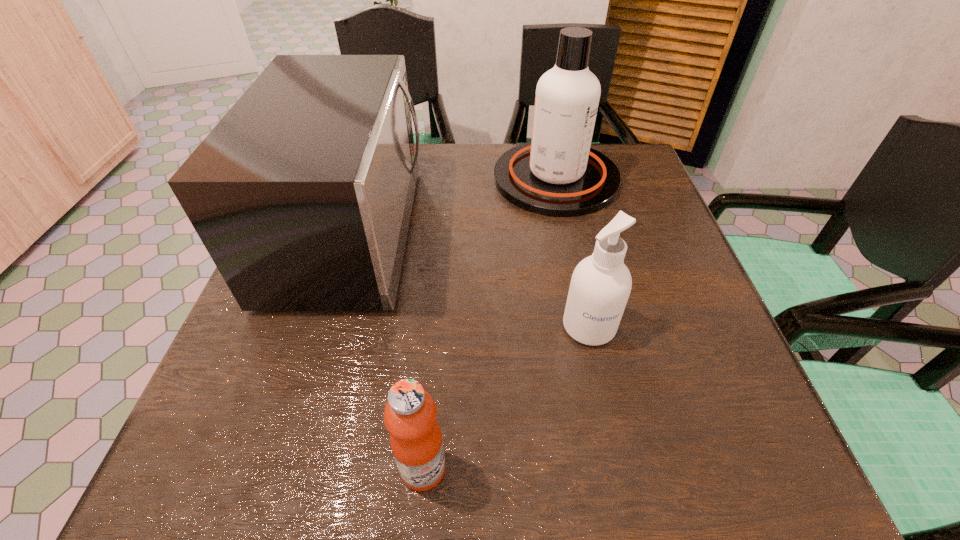
This screenshot has width=960, height=540. What are the coordinates of `vacant space at the left edge` in the screenshot? It's located at (303, 315).

Identify the location of vacant space at the right edge. This screenshot has width=960, height=540. (690, 319).

In the image, there is a desktop. Where is `blank space at the near left corner`? This screenshot has height=540, width=960. blank space at the near left corner is located at coordinates (230, 490).

Locate an element on the screen. The height and width of the screenshot is (540, 960). unoccupied area between the taller cleansing agent and the leftmost object is located at coordinates (454, 205).

The image size is (960, 540). What are the coordinates of `free point between the third tallest object and the tallest object` in the screenshot? It's located at (572, 253).

In order to click on free space between the fruit juice and the tallest object in this screenshot , I will do `click(490, 323)`.

In order to click on unoccupied area between the nearest object and the microwave oven in this screenshot , I will do `click(388, 350)`.

Where is `unoccupied area between the leftmost object and the tallest object`? unoccupied area between the leftmost object and the tallest object is located at coordinates (454, 205).

Find the location of a particular element. The height and width of the screenshot is (540, 960). vacant area between the microwave oven and the nearer cleansing agent is located at coordinates (470, 279).

Where is `vacant area that lies between the microwave oven and the taller cleansing agent`? This screenshot has height=540, width=960. vacant area that lies between the microwave oven and the taller cleansing agent is located at coordinates (454, 205).